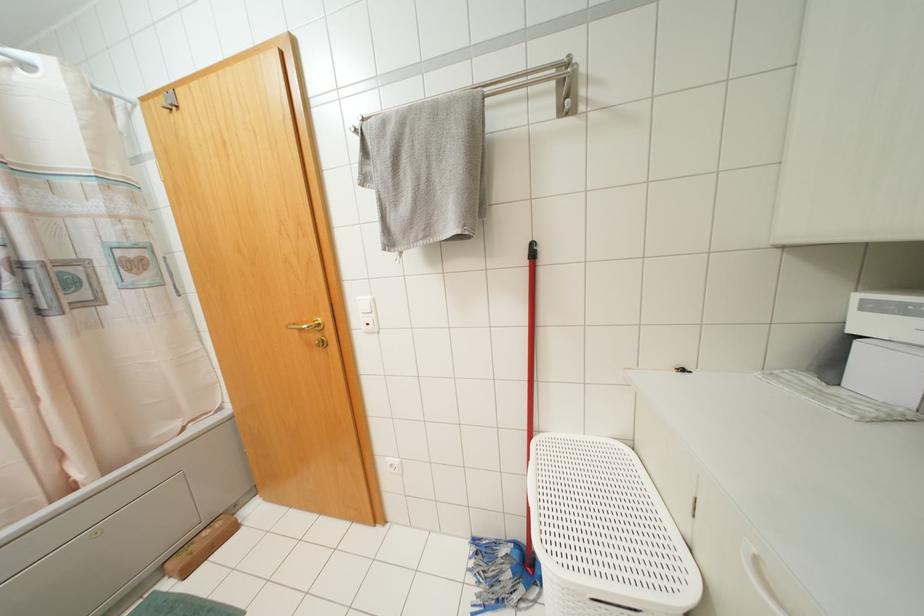
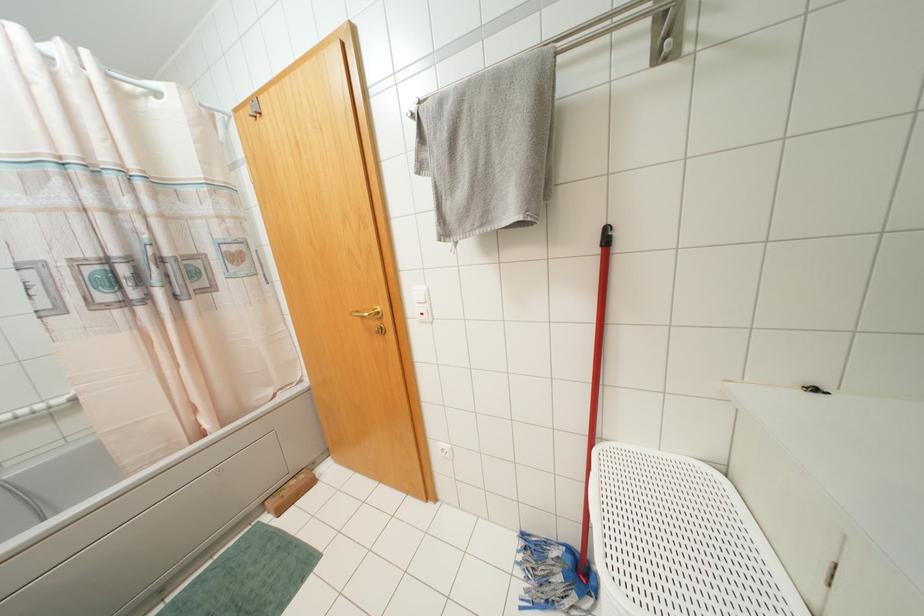
Question: The images are taken continuously from a first-person perspective. In which direction is your viewpoint rotating?

Choices:
 (A) Left
 (B) Right
 (C) Up
 (D) Down

Answer: (A)